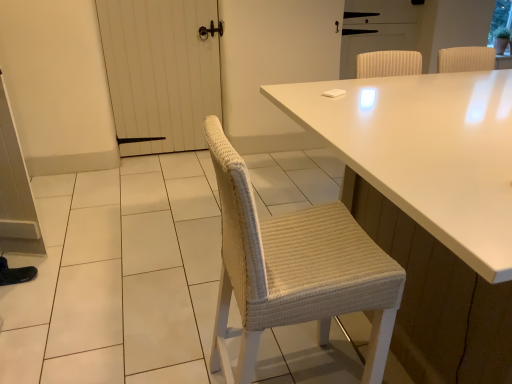
Question: From the image's perspective, does white wooden door at left, the first screen door in the left-to-right sequence, appear lower than white glossy table at center?

Choices:
 (A) no
 (B) yes

Answer: (A)

Question: Is white wooden door at left, the first screen door in the left-to-right sequence, at the left side of white glossy table at center?

Choices:
 (A) no
 (B) yes

Answer: (B)

Question: Is white wooden door at left, the first screen door in the left-to-right sequence, positioned before white glossy table at center?

Choices:
 (A) no
 (B) yes

Answer: (A)

Question: Could you tell me if white wooden door at left, the first screen door in the left-to-right sequence, is facing white glossy table at center?

Choices:
 (A) no
 (B) yes

Answer: (B)

Question: Is white wooden door at left, arranged as the 2th screen door when viewed from the right, further to the viewer compared to white glossy table at center?

Choices:
 (A) no
 (B) yes

Answer: (B)

Question: Looking at the image, does white glossy table at center seem bigger or smaller compared to white ribbed screen door at upper center, acting as the 1th screen door starting from the right?

Choices:
 (A) small
 (B) big

Answer: (B)

Question: Is white glossy table at center inside the boundaries of white ribbed screen door at upper center, acting as the 1th screen door starting from the right, or outside?

Choices:
 (A) outside
 (B) inside

Answer: (A)

Question: Is point (502, 77) closer or farther from the camera than point (376, 34)?

Choices:
 (A) farther
 (B) closer

Answer: (B)

Question: Would you say white glossy table at center is to the left or to the right of white ribbed screen door at upper center, the 2th screen door positioned from the left, in the picture?

Choices:
 (A) right
 (B) left

Answer: (B)

Question: In terms of width, does white ribbed screen door at upper center, acting as the 1th screen door starting from the right, look wider or thinner when compared to white glossy table at center?

Choices:
 (A) wide
 (B) thin

Answer: (B)

Question: From a real-world perspective, is white ribbed screen door at upper center, the 2th screen door positioned from the left, positioned above or below white glossy table at center?

Choices:
 (A) below
 (B) above

Answer: (B)

Question: In the image, is white ribbed screen door at upper center, the 2th screen door positioned from the left, positioned in front of or behind white glossy table at center?

Choices:
 (A) front
 (B) behind

Answer: (B)

Question: Do you think white ribbed screen door at upper center, acting as the 1th screen door starting from the right, is within white glossy table at center, or outside of it?

Choices:
 (A) outside
 (B) inside

Answer: (A)

Question: Is white wooden door at left, the first screen door in the left-to-right sequence, inside the boundaries of white ribbed screen door at upper center, the 2th screen door positioned from the left, or outside?

Choices:
 (A) outside
 (B) inside

Answer: (A)

Question: Is point (101, 26) positioned closer to the camera than point (393, 34)?

Choices:
 (A) farther
 (B) closer

Answer: (B)